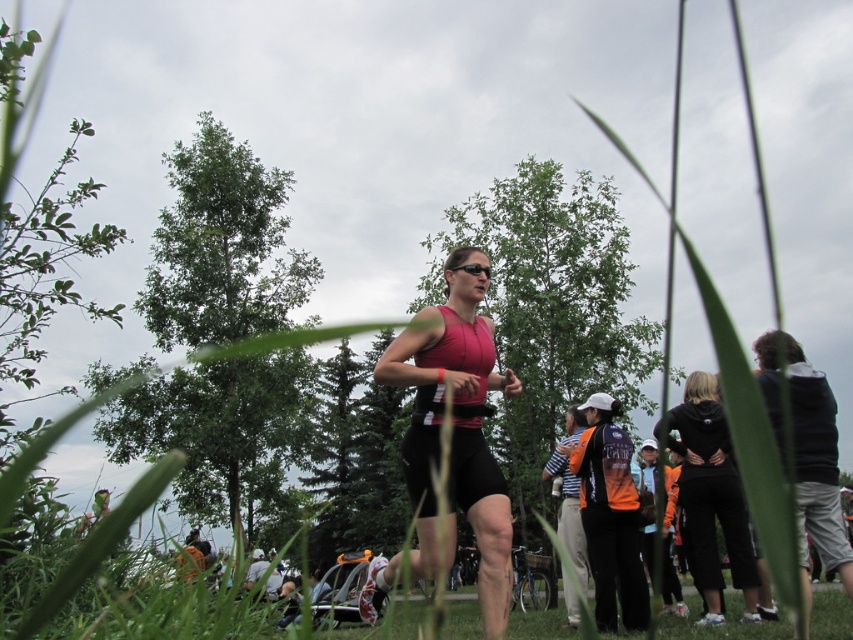
From the picture: You are a photographer positioned at the point with coordinates point (456,429). You want to capture a photo of the woman in red tank top and black shorts who is running in the midground. Is the woman in red tank top and black shorts visible from your current position?

The point (456,429) indicates matte pink tank top at center, so the woman in red tank top and black shorts is not visible from that position because the matte pink tank top at center is blocking the view.

You are standing at the point marked as point (376, 598) in the image, which is 5.27 meters away from you. You want to take a photo of the woman in red tank top and black shorts running in the midground. Can you capture her clearly in your shot without moving from your current position?

The distance of point (376, 598) from viewer is 5.27 meters. Since the woman in red tank top and black shorts is in the midground, which is between the foreground and background, and you are positioned at a point that is 5.27 meters away, it is likely that she will be in focus and visible in your photo without needing to move. However, the exact clarity depends on the camera lens and focus settings.

You are a photographer positioned at the center of the scene. You want to capture a photo that includes both the matte pink tank top at center and the black matte hoodie at lower right. What is the minimum distance you need to move backward to ensure both objects are in frame?

The matte pink tank top at center is 3.34 meters from the black matte hoodie at lower right. To include both in the frame, you need to move backward at least 3.34 meters so that the distance between them fits within your camera lens view.